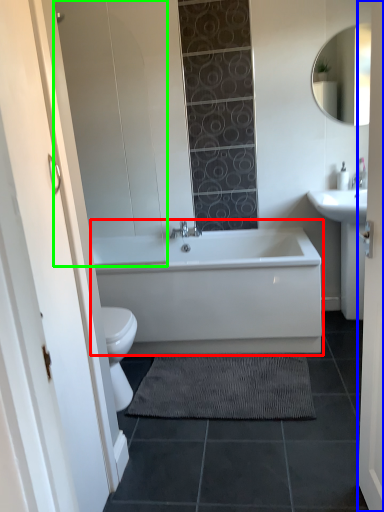
Question: Considering the real-world distances, which object is closest to bathtub (highlighted by a red box)? door (highlighted by a blue box) or glass door (highlighted by a green box).

Choices:
 (A) door
 (B) glass door

Answer: (B)